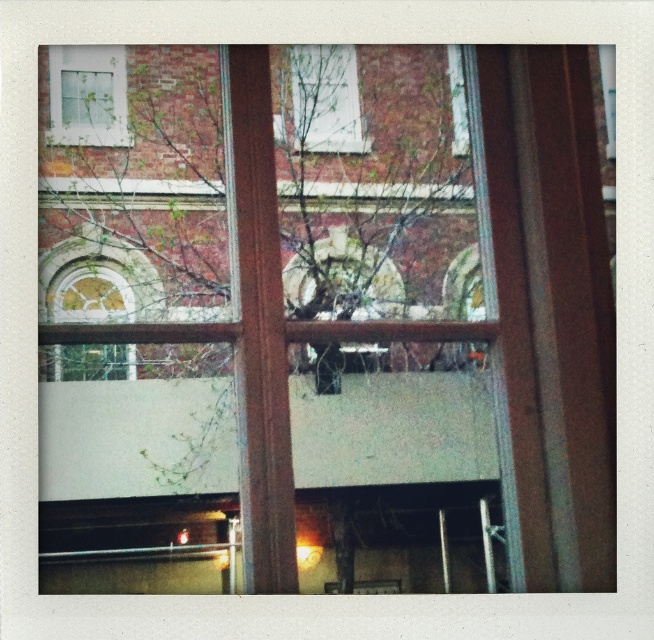
Question: Where is white matte window at upper left located in relation to transparent glass window at upper center in the image?

Choices:
 (A) right
 (B) left

Answer: (B)

Question: Among these points, which one is farthest from the camera?

Choices:
 (A) (58, 321)
 (B) (298, 140)

Answer: (B)

Question: Which object is farther from the camera taking this photo?

Choices:
 (A) gold leaf window at center
 (B) transparent glass window at upper center
 (C) green leafy tree at center
 (D) clear glass window at upper center

Answer: (B)

Question: Among these points, which one is nearest to the camera?

Choices:
 (A) (101, 52)
 (B) (353, 131)
 (C) (347, 112)
 (D) (453, 122)

Answer: (A)

Question: Is gold leaf window at center closer to camera compared to transparent glass window at upper center?

Choices:
 (A) no
 (B) yes

Answer: (B)

Question: Is clear glass window at upper center to the left of white matte window at upper left from the viewer's perspective?

Choices:
 (A) no
 (B) yes

Answer: (A)